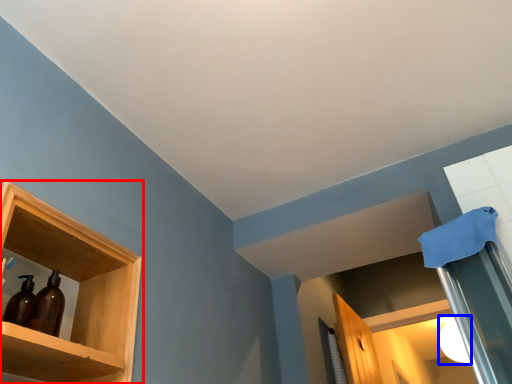
Question: Among these objects, which one is nearest to the camera, shelf (highlighted by a red box) or lighting (highlighted by a blue box)?

Choices:
 (A) shelf
 (B) lighting

Answer: (A)